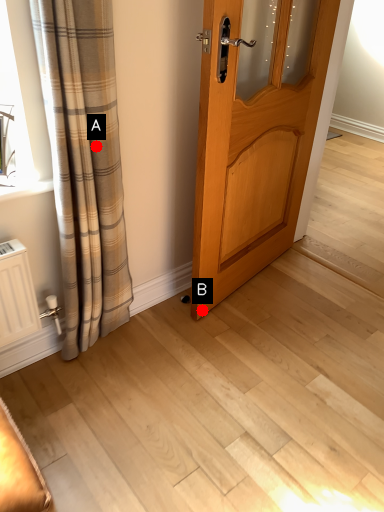
Question: Two points are circled on the image, labeled by A and B beside each circle. Which point is closer to the camera taking this photo?

Choices:
 (A) A is closer
 (B) B is closer

Answer: (A)